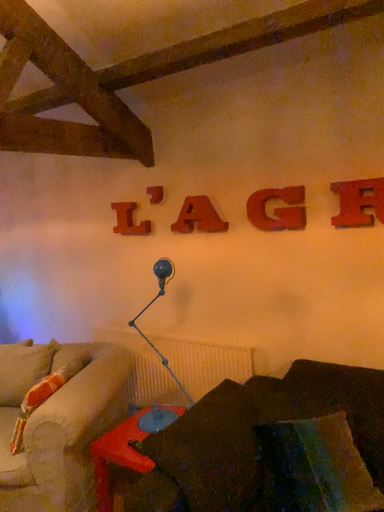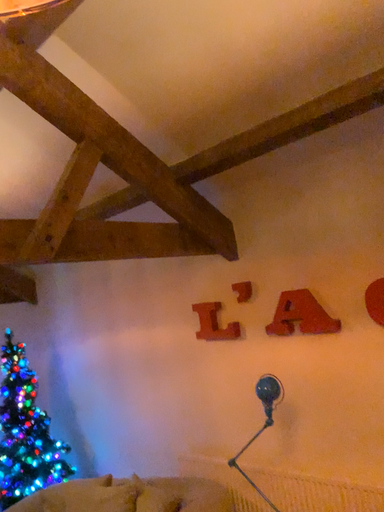
Question: Which way did the camera rotate in the video?

Choices:
 (A) rotated downward
 (B) rotated upward

Answer: (B)